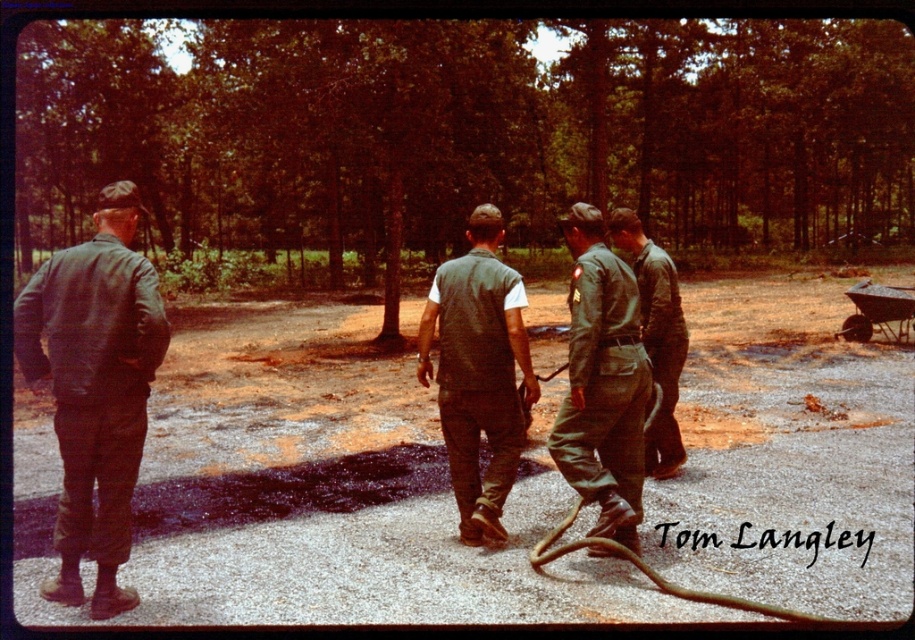
Is green uniform at center thinner than green matte uniform at center?

Yes.

Where is `green uniform at center`? The width and height of the screenshot is (915, 640). green uniform at center is located at coordinates click(x=601, y=381).

Looking at this image, can you confirm if green fabric vest at center is smaller than green matte uniform at center?

Yes, green fabric vest at center is smaller than green matte uniform at center.

Locate an element on the screen. Image resolution: width=915 pixels, height=640 pixels. green fabric vest at center is located at coordinates (478, 371).

Between point (94, 360) and point (458, 465), which one is positioned in front?

Point (94, 360) is more forward.

Is point (135, 385) less distant than point (453, 340)?

Yes, it is in front of point (453, 340).

Is point (159, 358) behind point (513, 477)?

No, (159, 358) is closer to viewer.

This screenshot has width=915, height=640. Identify the location of matte green jacket at left. (95, 387).